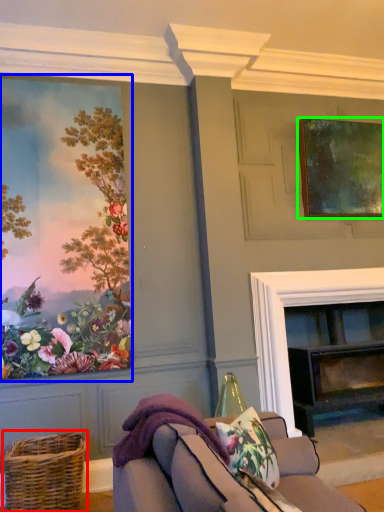
Question: Which object is positioned farthest from basket (highlighted by a red box)? Select from picture frame (highlighted by a blue box) and picture frame (highlighted by a green box).

Choices:
 (A) picture frame
 (B) picture frame

Answer: (B)